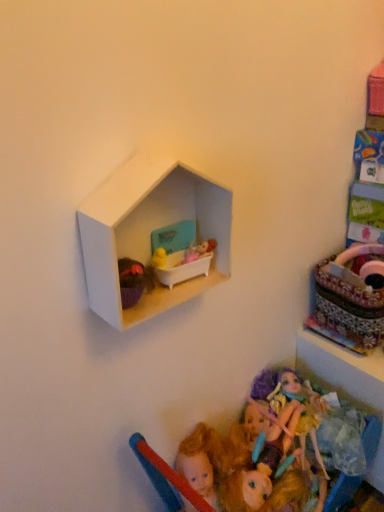
Question: Would you say patterned fabric basket at right is a long distance from multicolored plush doll at lower center?

Choices:
 (A) no
 (B) yes

Answer: (A)

Question: Is patterned fabric basket at right aimed at multicolored plush doll at lower center?

Choices:
 (A) yes
 (B) no

Answer: (B)

Question: Can you confirm if patterned fabric basket at right is thinner than multicolored plush doll at lower center?

Choices:
 (A) no
 (B) yes

Answer: (B)

Question: Is patterned fabric basket at right directly adjacent to multicolored plush doll at lower center?

Choices:
 (A) yes
 (B) no

Answer: (B)

Question: Considering the relative sizes of patterned fabric basket at right and multicolored plush doll at lower center in the image provided, is patterned fabric basket at right bigger than multicolored plush doll at lower center?

Choices:
 (A) yes
 (B) no

Answer: (A)

Question: Is patterned fabric basket at right taller than multicolored plush doll at lower center?

Choices:
 (A) no
 (B) yes

Answer: (B)

Question: From the image's perspective, is patterned fabric basket at right over white matte hexagonal shelf at upper center?

Choices:
 (A) no
 (B) yes

Answer: (A)

Question: Is patterned fabric basket at right in contact with white matte hexagonal shelf at upper center?

Choices:
 (A) yes
 (B) no

Answer: (B)

Question: Could you tell me if patterned fabric basket at right is turned towards white matte hexagonal shelf at upper center?

Choices:
 (A) no
 (B) yes

Answer: (A)

Question: Is patterned fabric basket at right at the left side of white matte hexagonal shelf at upper center?

Choices:
 (A) yes
 (B) no

Answer: (B)

Question: Is patterned fabric basket at right located outside white matte hexagonal shelf at upper center?

Choices:
 (A) yes
 (B) no

Answer: (A)

Question: Does patterned fabric basket at right have a smaller size compared to white matte hexagonal shelf at upper center?

Choices:
 (A) yes
 (B) no

Answer: (B)

Question: Is multicolored plush doll at lower center looking in the opposite direction of white matte hexagonal shelf at upper center?

Choices:
 (A) yes
 (B) no

Answer: (B)